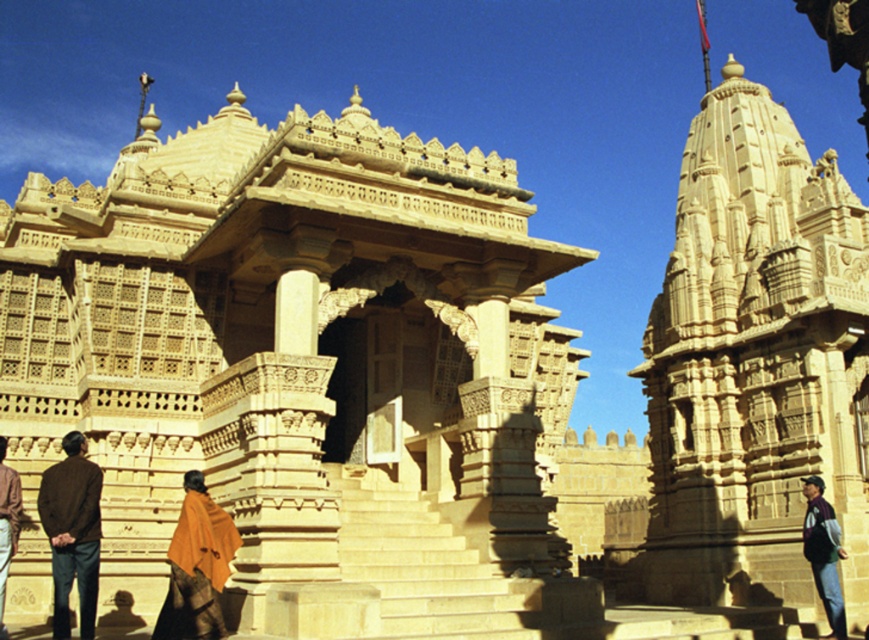
Between beige stone temple at upper right and brown fabric at lower left, which one is positioned lower?

brown fabric at lower left is lower down.

Does beige stone temple at upper right appear on the left side of brown fabric at lower left?

In fact, beige stone temple at upper right is to the right of brown fabric at lower left.

The width and height of the screenshot is (869, 640). In order to click on beige stone temple at upper right in this screenshot , I will do `click(755, 364)`.

This screenshot has height=640, width=869. Identify the location of beige stone temple at upper right. (755, 364).

Is brown fabric coat at lower left below orange fabric shawl at lower left?

No, brown fabric coat at lower left is not below orange fabric shawl at lower left.

Which is more to the right, brown fabric coat at lower left or orange fabric shawl at lower left?

orange fabric shawl at lower left is more to the right.

Image resolution: width=869 pixels, height=640 pixels. I want to click on brown fabric coat at lower left, so click(x=71, y=532).

Locate an element on the screen. brown fabric coat at lower left is located at coordinates (71, 532).

Does orange fabric shawl at lower left appear over dark purple sweater at right?

Indeed, orange fabric shawl at lower left is positioned over dark purple sweater at right.

Locate an element on the screen. orange fabric shawl at lower left is located at coordinates (197, 566).